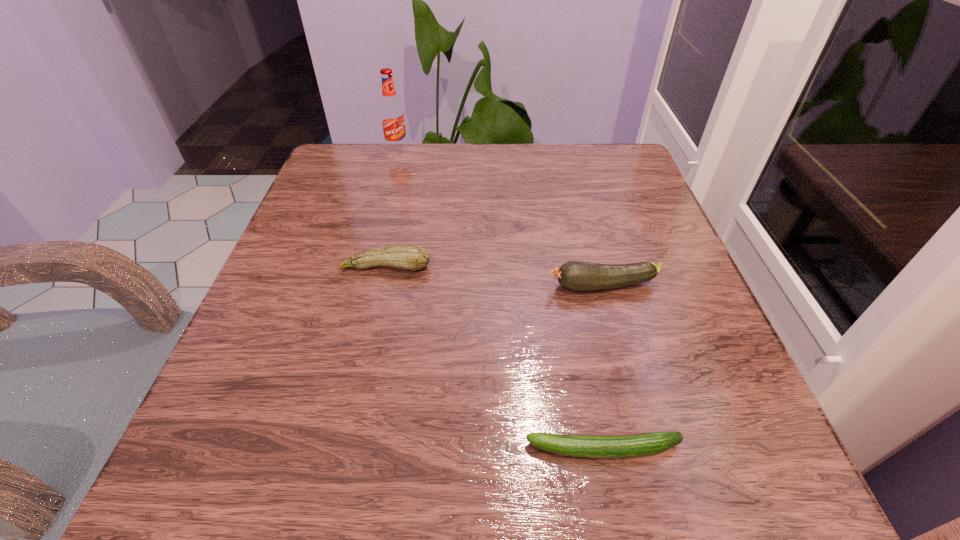
The width and height of the screenshot is (960, 540). Identify the location of the tallest object. pos(392,115).

Identify the location of the farthest object. (x=392, y=115).

This screenshot has height=540, width=960. I want to click on the leftmost zucchini, so click(408, 257).

The image size is (960, 540). What are the coordinates of `the nearest zucchini` in the screenshot? It's located at (638, 445).

I want to click on the nearest object, so click(x=638, y=445).

In order to click on free region located on the left of the tallest object in this screenshot , I will do `click(355, 150)`.

Where is `vacant space located 0.080m at the stem end of the leftmost zucchini`? The width and height of the screenshot is (960, 540). vacant space located 0.080m at the stem end of the leftmost zucchini is located at coordinates (376, 310).

Where is `vacant space situated on the front-facing side of the shortest zucchini`? vacant space situated on the front-facing side of the shortest zucchini is located at coordinates (480, 449).

Find the location of `free location located 0.190m on the front-facing side of the shortest zucchini`. free location located 0.190m on the front-facing side of the shortest zucchini is located at coordinates (379, 449).

I want to click on vacant region located on the front-facing side of the shortest zucchini, so click(480, 449).